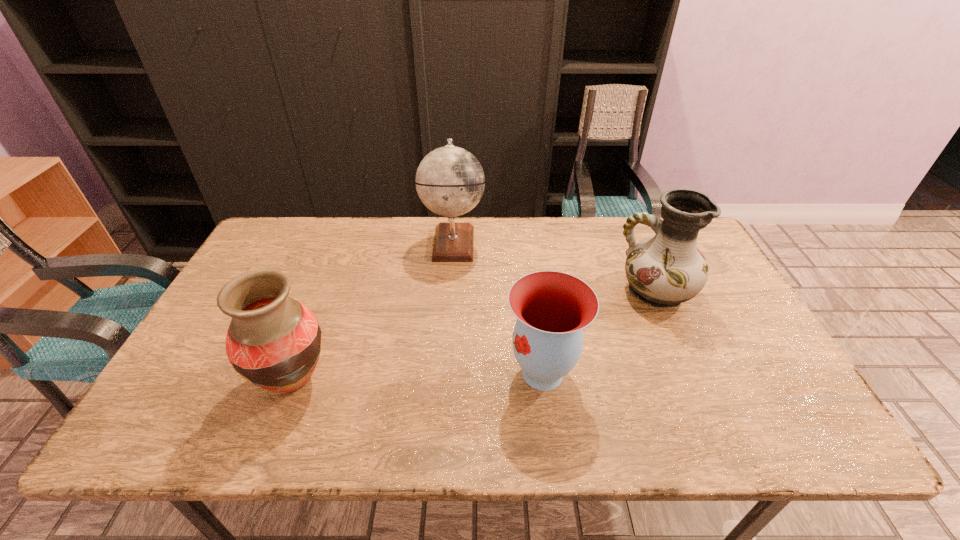
Where is `vacant space that satisfies the following two spatial constraints: 1. at the equator of the second object from right to left; 2. on the left side of the globe`? vacant space that satisfies the following two spatial constraints: 1. at the equator of the second object from right to left; 2. on the left side of the globe is located at coordinates click(x=444, y=373).